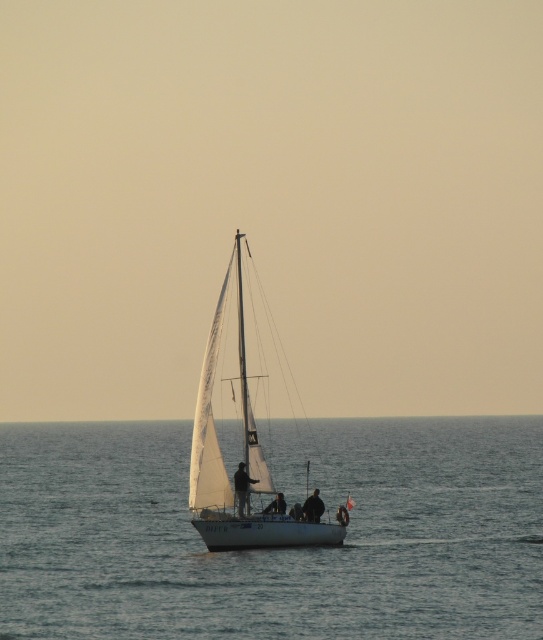
You are a photographer planning to take a photo of the clear blue water at center and the white sailboat at center. Based on their positions, which one would appear closer to the camera in the photo?

The clear blue water at center appears closer to the camera in the photo because it is positioned in front of the white sailboat at center according to the scene description.

You are a photographer planning to take a photo of the white sailboat at center and the dark fabric jacket at center. Which object should you focus on first if you want to capture both in a single shot without adjusting the camera focus? Explain your reasoning based on their sizes in the image.

The white sailboat at center has a greater height compared to the dark fabric jacket at center. Therefore, focusing on the white sailboat at center first would ensure it is in sharp focus, and the dark fabric jacket at center, being smaller, would also be in focus due to the depth of field.

You are a photographer trying to capture the scene of the white sailboat at center and the dark fabric jacket at center. You want to ensure the sailboat appears to the left of the jacket in your photo. Based on the scene, is this arrangement possible?

Yes, the white sailboat at center is already positioned to the left of the dark fabric jacket at center, so this arrangement is possible.